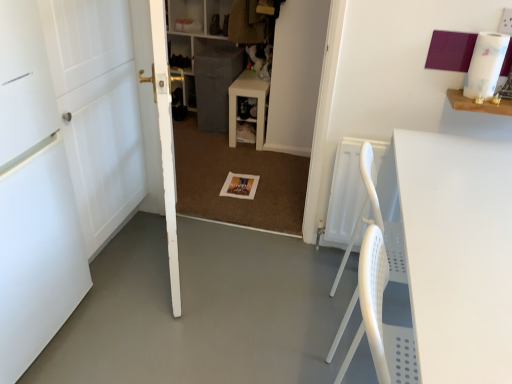
Locate an element on the screen. Image resolution: width=512 pixels, height=384 pixels. vacant space underneath white wooden door at left, the 3th door when ordered from left to right (from a real-world perspective) is located at coordinates (180, 265).